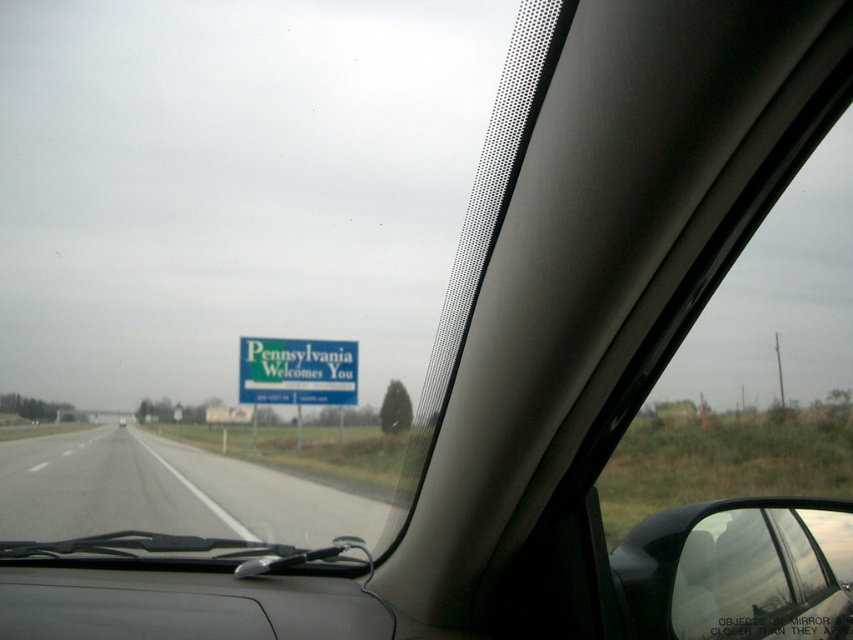
Is gray asphalt highway at center bigger than green matte signboard at center?

Correct, gray asphalt highway at center is larger in size than green matte signboard at center.

Can you confirm if gray asphalt highway at center is positioned to the left of green matte signboard at center?

Correct, you'll find gray asphalt highway at center to the left of green matte signboard at center.

Between point (73, 452) and point (337, 388), which one is positioned behind?

The point (337, 388) is more distant.

Where is `gray asphalt highway at center`? gray asphalt highway at center is located at coordinates (165, 492).